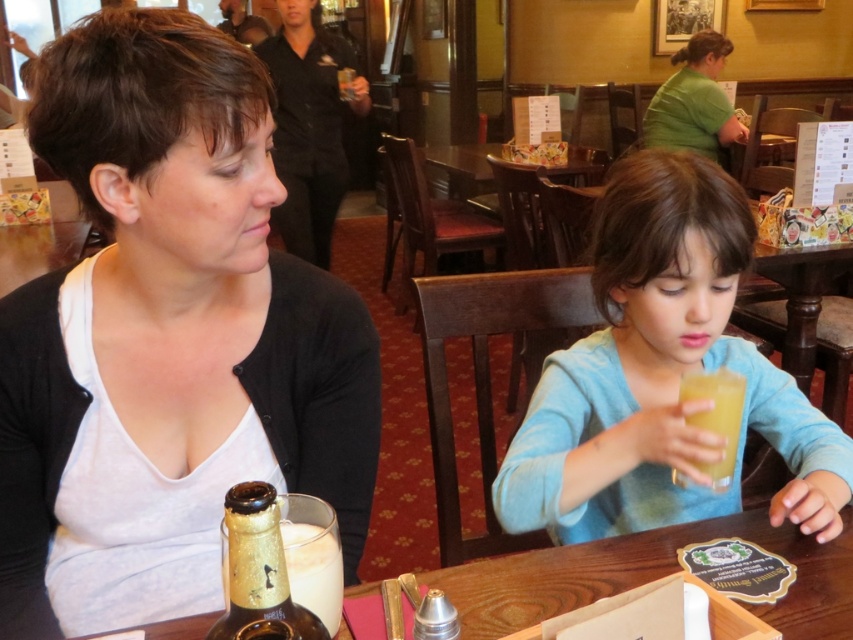
You are a waiter in this restaurant and need to place a new drink order on the table. The table has the matte black shirt at center and the translucent plastic cup at lower center. Which object should you avoid placing the drink near to prevent it from tipping over?

You should avoid placing the drink near the translucent plastic cup at lower center because the matte black shirt at center is taller than the translucent plastic cup at lower center, making the shirt a more stable surface.

You are a server at the restaurant and need to place a new order of appetizers on the wooden table at center. The appetizers come in a tray that is as wide as the translucent plastic cup at lower center. Will the tray fit on the table?

The wooden table at center might be wider than the translucent plastic cup at lower center, so the tray, which is as wide as the cup, should fit on the table.